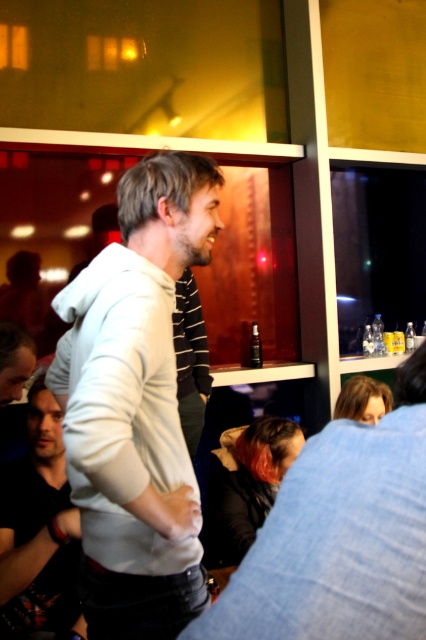
Does point (100, 276) lie in front of point (259, 349)?

Yes, point (100, 276) is closer to viewer.

Between point (103, 413) and point (259, 340), which one is positioned behind?

The point (259, 340) is more distant.

Describe the element at coordinates (135, 404) in the screenshot. I see `white hoodie at center` at that location.

The width and height of the screenshot is (426, 640). I want to click on white hoodie at center, so click(x=135, y=404).

Does dark gray hoodie at center appear over transparent plastic bottle at center?

Actually, dark gray hoodie at center is below transparent plastic bottle at center.

Is dark gray hoodie at center to the left of transparent plastic bottle at center from the viewer's perspective?

Indeed, dark gray hoodie at center is positioned on the left side of transparent plastic bottle at center.

Identify the location of dark gray hoodie at center. pos(37,525).

Based on the photo, can you confirm if white hoodie at center is positioned below dark gray hoodie at center?

Incorrect, white hoodie at center is not positioned below dark gray hoodie at center.

Is white hoodie at center further to camera compared to dark gray hoodie at center?

That is False.

Which is behind, point (193, 480) or point (0, 572)?

Positioned behind is point (0, 572).

Locate an element on the screen. The image size is (426, 640). white hoodie at center is located at coordinates (135, 404).